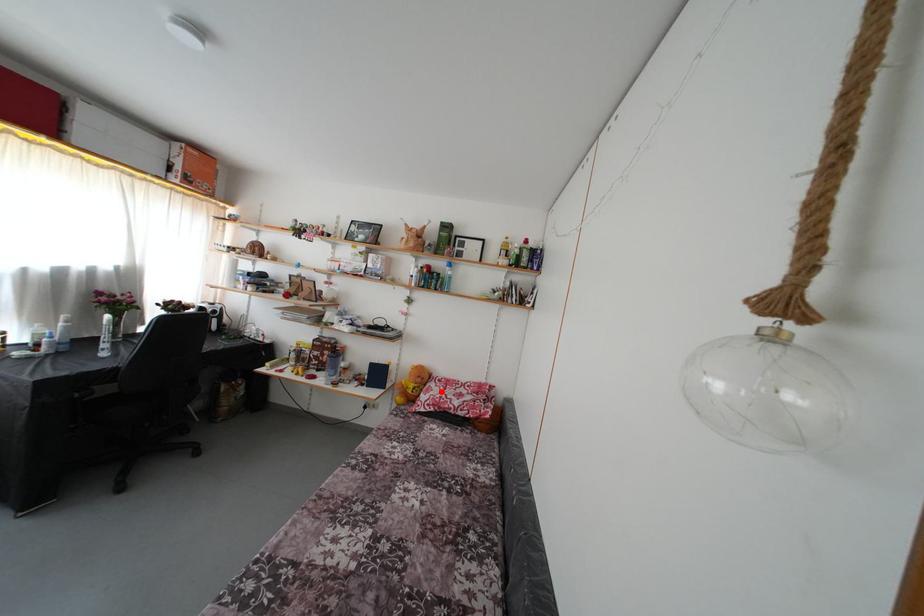
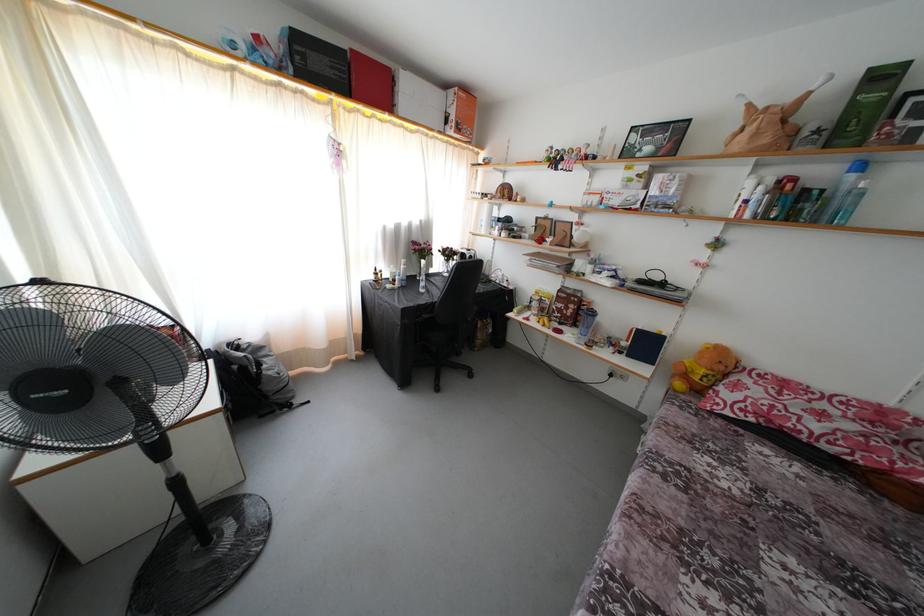
Question: I am providing you with two images of the same scene from different viewpoints. In image1, a red point is highlighted. Considering the same 3D point in image2, which of the following is correct?

Choices:
 (A) It is closer
 (B) It is farther

Answer: (A)